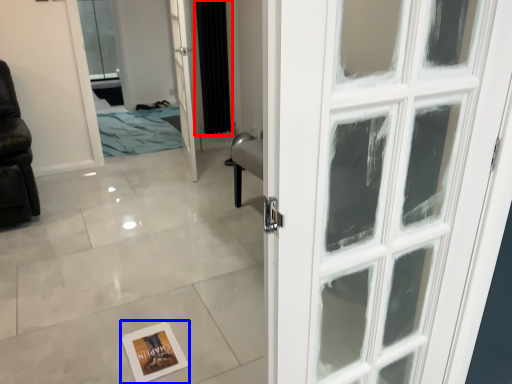
Question: Which point is closer to the camera, curtain (highlighted by a red box) or postcard (highlighted by a blue box)?

Choices:
 (A) curtain
 (B) postcard

Answer: (B)